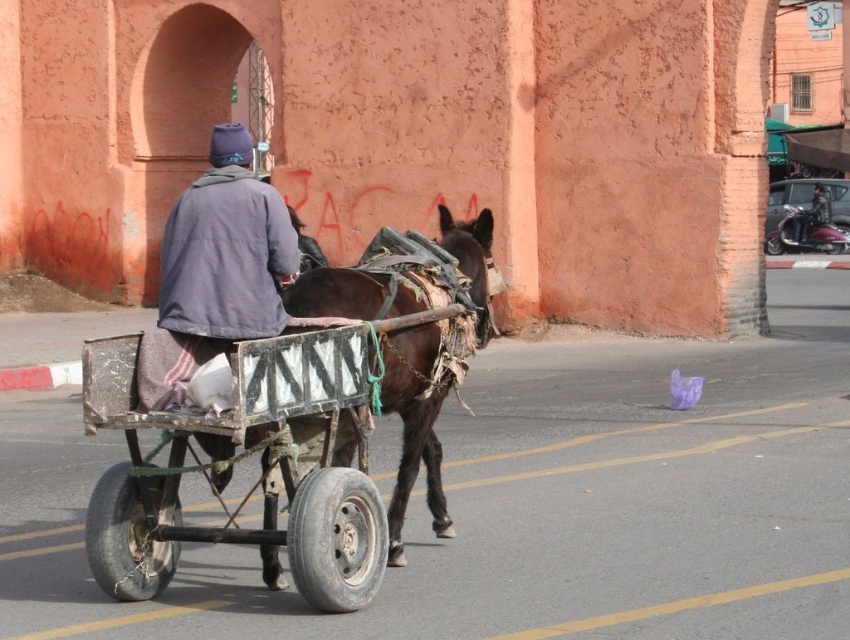
Question: Can you confirm if rusty metal cart at center is positioned above brown leather donkey at center?

Choices:
 (A) yes
 (B) no

Answer: (B)

Question: Which is nearer to the rusty metal cart at center?

Choices:
 (A) brown leather donkey at center
 (B) metallic helmet at upper right

Answer: (A)

Question: Is rusty metal cart at center to the right of metallic helmet at upper right from the viewer's perspective?

Choices:
 (A) no
 (B) yes

Answer: (A)

Question: Which object appears closest to the camera in this image?

Choices:
 (A) brown leather donkey at center
 (B) rusty metal cart at center
 (C) metallic helmet at upper right

Answer: (B)

Question: Which of the following is the farthest from the observer?

Choices:
 (A) brown leather donkey at center
 (B) rusty metal cart at center
 (C) metallic helmet at upper right

Answer: (C)

Question: Is the position of brown leather donkey at center less distant than that of metallic helmet at upper right?

Choices:
 (A) yes
 (B) no

Answer: (A)